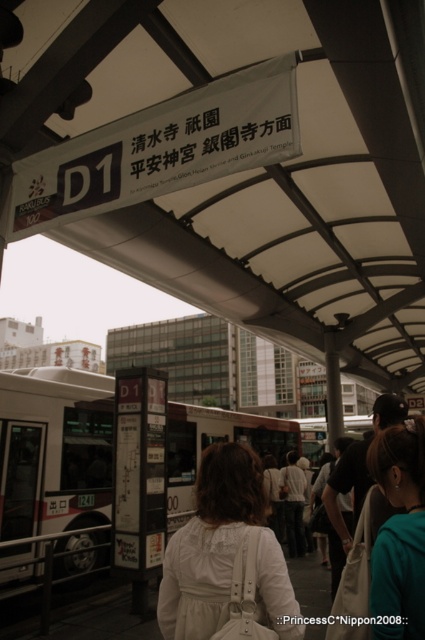
Question: From the image, what is the correct spatial relationship of white fabric dress at center in relation to teal fabric hair at center?

Choices:
 (A) left
 (B) right

Answer: (A)

Question: Can you confirm if white plastic bus at center is positioned to the right of teal fabric hair at center?

Choices:
 (A) no
 (B) yes

Answer: (A)

Question: Which object is farther from the camera taking this photo?

Choices:
 (A) white fabric dress at center
 (B) teal fabric hair at center

Answer: (A)

Question: Does white plastic bus at center have a larger size compared to white fabric dress at center?

Choices:
 (A) no
 (B) yes

Answer: (B)

Question: Among these points, which one is farthest from the camera?

Choices:
 (A) (175, 444)
 (B) (190, 605)

Answer: (A)

Question: Which of the following is the farthest from the observer?

Choices:
 (A) white fabric dress at center
 (B) teal fabric hair at center

Answer: (A)